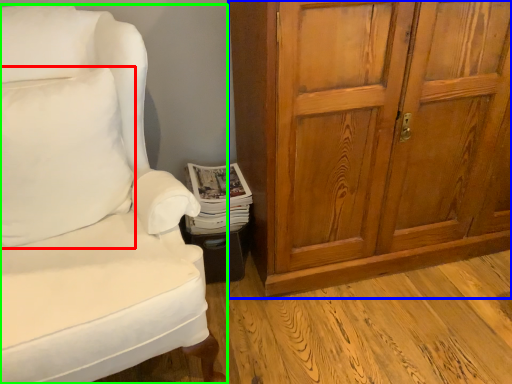
Question: Which object is the closest to the pillow (highlighted by a red box)? Choose among these: cabinetry (highlighted by a blue box) or chair (highlighted by a green box).

Choices:
 (A) cabinetry
 (B) chair

Answer: (B)